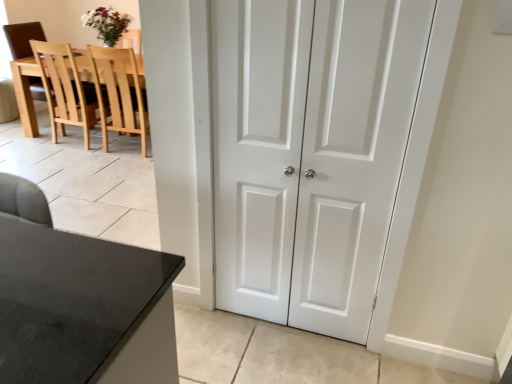
Question: Can you confirm if white smooth door at center is thinner than light brown wood chair at left, the 2th chair in the right-to-left sequence?

Choices:
 (A) yes
 (B) no

Answer: (A)

Question: Is white smooth door at center smaller than light brown wood chair at left, the 2th chair in the right-to-left sequence?

Choices:
 (A) yes
 (B) no

Answer: (A)

Question: Is white smooth door at center at the left side of light brown wood chair at left, the 2th chair in the right-to-left sequence?

Choices:
 (A) no
 (B) yes

Answer: (A)

Question: Is white smooth door at center behind light brown wood chair at left, which is counted as the first chair, starting from the left?

Choices:
 (A) no
 (B) yes

Answer: (A)

Question: Is white smooth door at center taller than light brown wood chair at left, the 2th chair in the right-to-left sequence?

Choices:
 (A) no
 (B) yes

Answer: (B)

Question: Is white smooth door at center far from light brown wood chair at left, the 2th chair in the right-to-left sequence?

Choices:
 (A) yes
 (B) no

Answer: (A)

Question: Is light brown wood chair at left, which is counted as the first chair, starting from the left, taller than light wood chair at upper left, the second chair viewed from the left?

Choices:
 (A) no
 (B) yes

Answer: (B)

Question: Is light brown wood chair at left, the 2th chair in the right-to-left sequence, to the right of light wood chair at upper left, the second chair viewed from the left, from the viewer's perspective?

Choices:
 (A) yes
 (B) no

Answer: (B)

Question: Is light brown wood chair at left, which is counted as the first chair, starting from the left, in contact with light wood chair at upper left, arranged as the first chair when viewed from the right?

Choices:
 (A) yes
 (B) no

Answer: (B)

Question: Is light brown wood chair at left, which is counted as the first chair, starting from the left, oriented towards light wood chair at upper left, arranged as the first chair when viewed from the right?

Choices:
 (A) yes
 (B) no

Answer: (A)

Question: Is light brown wood chair at left, the 2th chair in the right-to-left sequence, far from light wood chair at upper left, the second chair viewed from the left?

Choices:
 (A) yes
 (B) no

Answer: (A)

Question: Can you confirm if light brown wood chair at left, the 2th chair in the right-to-left sequence, is smaller than light wood chair at upper left, the second chair viewed from the left?

Choices:
 (A) no
 (B) yes

Answer: (A)

Question: Is the position of light wood chair at upper left, arranged as the first chair when viewed from the right, more distant than that of white smooth door at center?

Choices:
 (A) no
 (B) yes

Answer: (B)